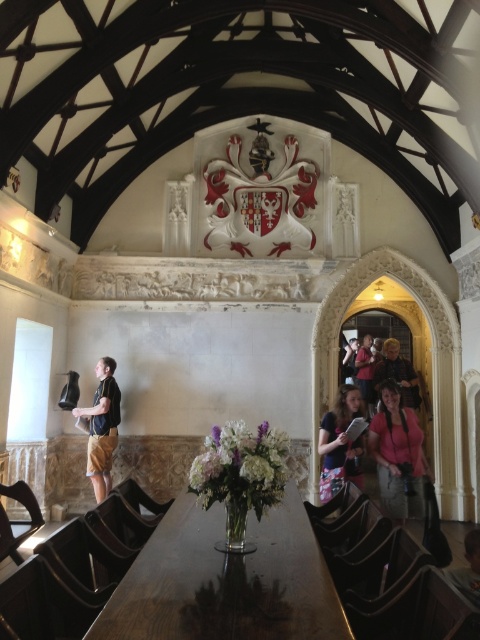
Does wooden table at center appear under matte black jacket at lower right?

Yes.

Is the position of wooden table at center more distant than that of matte black jacket at lower right?

No, it is not.

Find the location of a particular element. wooden table at center is located at coordinates (226, 580).

Who is positioned more to the right, matte pink shirt at center or matte black jacket at lower right?

matte black jacket at lower right is more to the right.

Who is shorter, matte pink shirt at center or matte black jacket at lower right?

Standing shorter between the two is matte black jacket at lower right.

Does point (350, 403) come in front of point (397, 376)?

Yes, it is.

This screenshot has height=640, width=480. What are the coordinates of `matte pink shirt at center` in the screenshot? It's located at (343, 436).

Between pink fabric at lower right and matte black jacket at lower right, which one appears on the left side from the viewer's perspective?

From the viewer's perspective, pink fabric at lower right appears more on the left side.

Looking at this image, is pink fabric at lower right taller than matte black jacket at lower right?

Indeed, pink fabric at lower right has a greater height compared to matte black jacket at lower right.

I want to click on pink fabric at lower right, so click(397, 456).

Where is `pink fabric at lower right`? pink fabric at lower right is located at coordinates pyautogui.click(x=397, y=456).